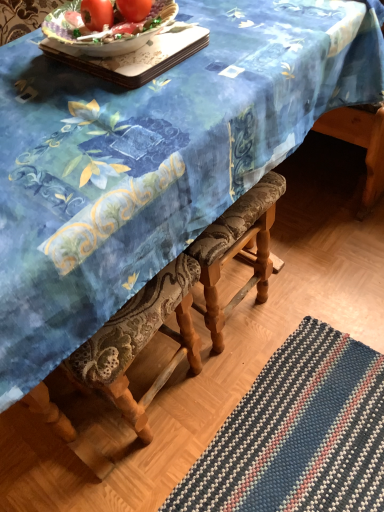
Question: Which direction should I rotate to look at matte red tomato at upper center, marked as the first tomato in a left-to-right arrangement, — up or down?

Choices:
 (A) down
 (B) up

Answer: (B)

Question: Does matte red tomato at upper center, which ranks as the second tomato in right-to-left order, appear on the left side of matte red tomato at upper center, the second tomato when ordered from left to right?

Choices:
 (A) yes
 (B) no

Answer: (A)

Question: Considering the relative sizes of matte red tomato at upper center, which ranks as the second tomato in right-to-left order, and matte red tomato at upper center, the 1th tomato in the right-to-left sequence, in the image provided, is matte red tomato at upper center, which ranks as the second tomato in right-to-left order, wider than matte red tomato at upper center, the 1th tomato in the right-to-left sequence,?

Choices:
 (A) no
 (B) yes

Answer: (B)

Question: Considering the relative sizes of matte red tomato at upper center, marked as the first tomato in a left-to-right arrangement, and matte red tomato at upper center, the 1th tomato in the right-to-left sequence, in the image provided, is matte red tomato at upper center, marked as the first tomato in a left-to-right arrangement, smaller than matte red tomato at upper center, the 1th tomato in the right-to-left sequence,?

Choices:
 (A) yes
 (B) no

Answer: (B)

Question: Is matte red tomato at upper center, marked as the first tomato in a left-to-right arrangement, oriented towards matte red tomato at upper center, the 1th tomato in the right-to-left sequence?

Choices:
 (A) no
 (B) yes

Answer: (A)

Question: Is matte red tomato at upper center, marked as the first tomato in a left-to-right arrangement, far from matte red tomato at upper center, the second tomato when ordered from left to right?

Choices:
 (A) yes
 (B) no

Answer: (B)

Question: From the image's perspective, would you say matte red tomato at upper center, which ranks as the second tomato in right-to-left order, is positioned over matte red tomato at upper center, the second tomato when ordered from left to right?

Choices:
 (A) yes
 (B) no

Answer: (B)

Question: Is porcelain tray at upper center outside of matte red tomato at upper center, the 1th tomato in the right-to-left sequence?

Choices:
 (A) yes
 (B) no

Answer: (A)

Question: From a real-world perspective, is porcelain tray at upper center under matte red tomato at upper center, the second tomato when ordered from left to right?

Choices:
 (A) yes
 (B) no

Answer: (A)

Question: Is porcelain tray at upper center bigger than matte red tomato at upper center, the 1th tomato in the right-to-left sequence?

Choices:
 (A) yes
 (B) no

Answer: (A)

Question: Is porcelain tray at upper center smaller than matte red tomato at upper center, the 1th tomato in the right-to-left sequence?

Choices:
 (A) yes
 (B) no

Answer: (B)

Question: Is porcelain tray at upper center further to the viewer compared to matte red tomato at upper center, the second tomato when ordered from left to right?

Choices:
 (A) no
 (B) yes

Answer: (A)

Question: From the image's perspective, is porcelain tray at upper center located above matte red tomato at upper center, the 1th tomato in the right-to-left sequence?

Choices:
 (A) no
 (B) yes

Answer: (A)

Question: Considering the relative sizes of matte red tomato at upper center, the second tomato when ordered from left to right, and porcelain tray at upper center in the image provided, is matte red tomato at upper center, the second tomato when ordered from left to right, thinner than porcelain tray at upper center?

Choices:
 (A) yes
 (B) no

Answer: (A)